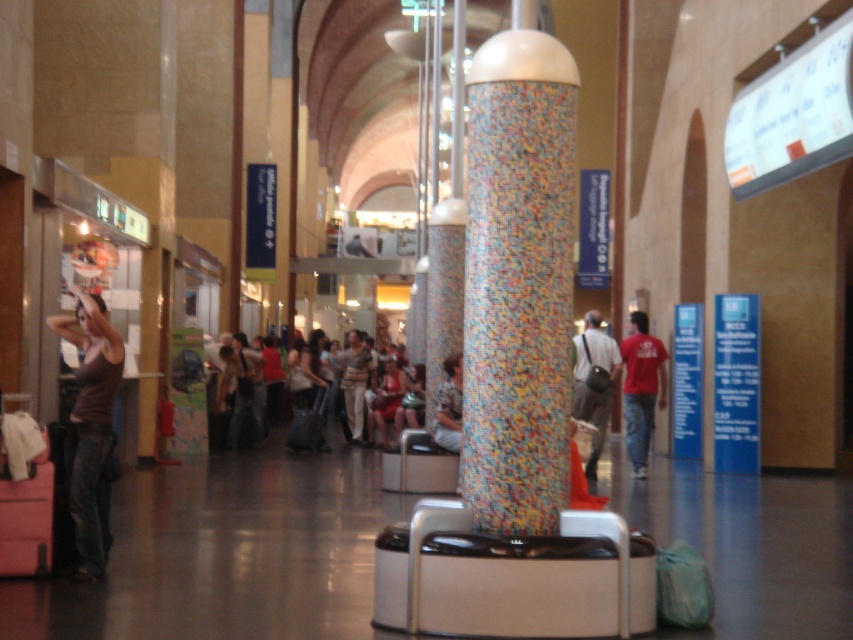
You are an observer in the public transportation hub described. You notice two clothing items on the floor near the cylindrical pillar with a mosaic design. Which clothing item is taller, the matte brown tank top at left or the matte beige shirt at center?

The matte brown tank top at left is taller than the matte beige shirt at center according to the description.